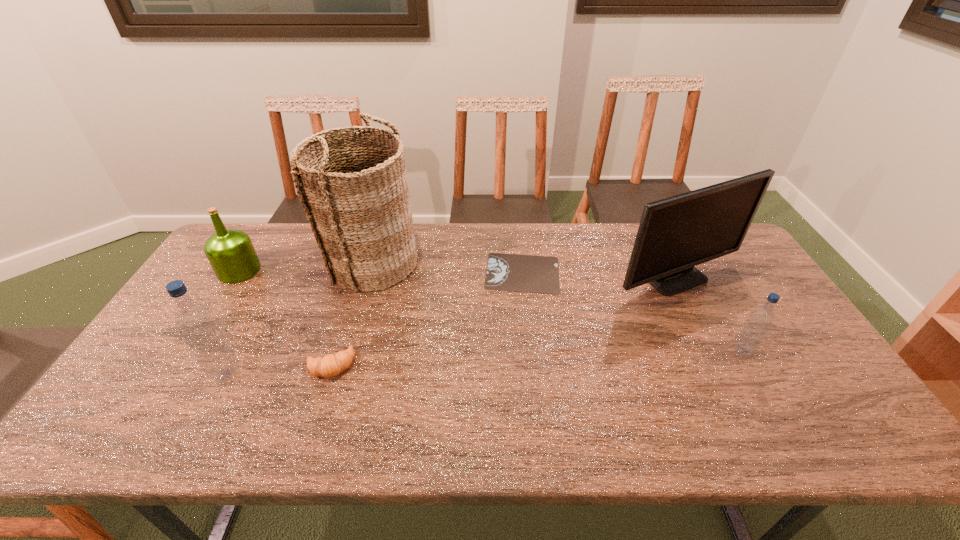
The image size is (960, 540). In order to click on location for an additional water_bottle to make spacing equal in this screenshot , I will do `click(491, 362)`.